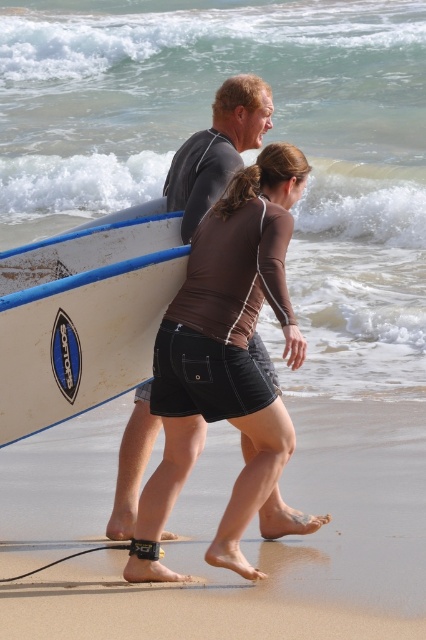
Question: Which of these objects is positioned farthest from the black fabric shorts at center?

Choices:
 (A) white matte surfboard at left
 (B) brown matte shorts at center

Answer: (A)

Question: Based on their relative distances, which object is nearer to the brown matte shorts at center?

Choices:
 (A) black fabric shorts at center
 (B) white matte surfboard at left

Answer: (B)

Question: Can you confirm if brown matte shorts at center is thinner than white matte surfboard at left?

Choices:
 (A) no
 (B) yes

Answer: (A)

Question: Observing the image, what is the correct spatial positioning of brown matte shorts at center in reference to white matte surfboard at left?

Choices:
 (A) right
 (B) left

Answer: (A)

Question: Does brown matte shorts at center come in front of white matte surfboard at left?

Choices:
 (A) no
 (B) yes

Answer: (B)

Question: Among these points, which one is nearest to the camera?

Choices:
 (A) (20, 461)
 (B) (258, 288)

Answer: (B)